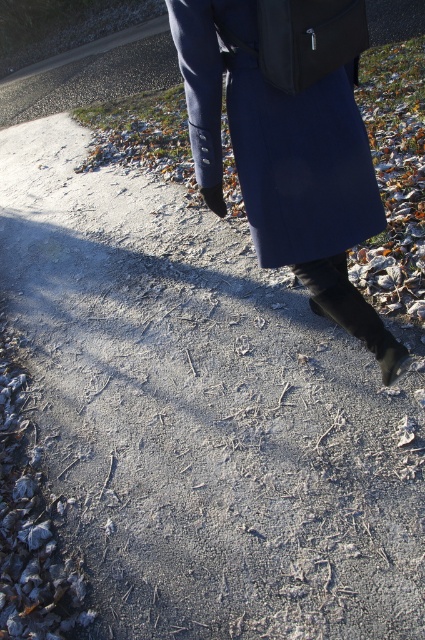
Is navy wool coat at center shorter than black suede boot at lower center?

No, navy wool coat at center is not shorter than black suede boot at lower center.

Which is above, navy wool coat at center or black suede boot at lower center?

navy wool coat at center

Describe the element at coordinates (275, 138) in the screenshot. I see `navy wool coat at center` at that location.

Where is `navy wool coat at center`? navy wool coat at center is located at coordinates (275, 138).

Locate an element on the screen. The height and width of the screenshot is (640, 425). navy wool coat at center is located at coordinates (275, 138).

Can you confirm if navy wool coat at center is shorter than matte black bag at center?

Incorrect, navy wool coat at center's height does not fall short of matte black bag at center's.

The height and width of the screenshot is (640, 425). What are the coordinates of `navy wool coat at center` in the screenshot? It's located at (275, 138).

Measure the distance between matte black bag at center and black suede boot at lower center.

matte black bag at center and black suede boot at lower center are 26.60 inches apart.

Who is shorter, matte black bag at center or black suede boot at lower center?

Result: matte black bag at center

Between point (337, 29) and point (337, 266), which one is positioned behind?

Positioned behind is point (337, 266).

At what (x,y) coordinates should I click in order to perform the action: click on matte black bag at center. Please return your answer as a coordinate pair (x, y). This screenshot has height=640, width=425. Looking at the image, I should click on (308, 38).